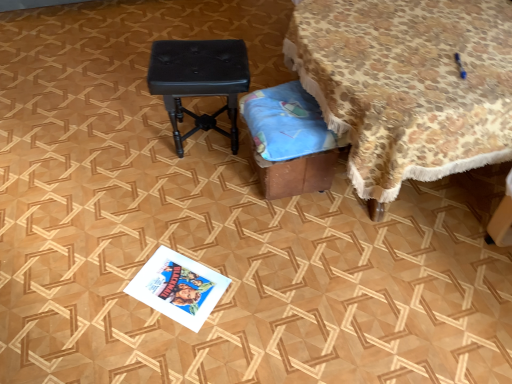
Where is `free space above black leather stool at center (from a real-world perspective)`? free space above black leather stool at center (from a real-world perspective) is located at coordinates (202, 54).